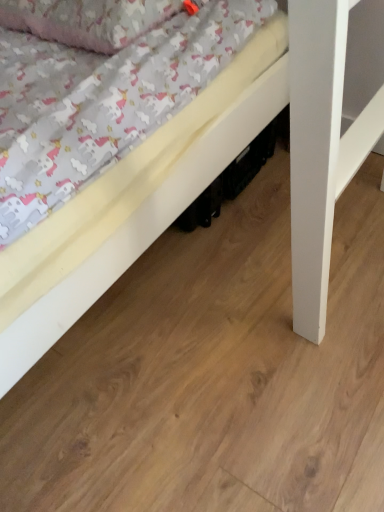
What do you see at coordinates (87, 20) in the screenshot? The width and height of the screenshot is (384, 512). I see `fluffy cotton pillow at upper left` at bounding box center [87, 20].

Identify the location of fluffy cotton pillow at upper left. (87, 20).

Where is `white matte bed at lower left`? This screenshot has width=384, height=512. white matte bed at lower left is located at coordinates (132, 204).

Image resolution: width=384 pixels, height=512 pixels. Describe the element at coordinates (132, 204) in the screenshot. I see `white matte bed at lower left` at that location.

I want to click on fluffy cotton pillow at upper left, so click(87, 20).

From the picture: Is white matte bed at lower left to the left of fluffy cotton pillow at upper left from the viewer's perspective?

Incorrect, white matte bed at lower left is not on the left side of fluffy cotton pillow at upper left.

Is white matte bed at lower left further to camera compared to fluffy cotton pillow at upper left?

No.

Considering the positions of point (223, 156) and point (49, 2), is point (223, 156) closer or farther from the camera than point (49, 2)?

Clearly, point (223, 156) is more distant from the camera than point (49, 2).

Based on the photo, from the image's perspective, is white matte bed at lower left located above fluffy cotton pillow at upper left?

Actually, white matte bed at lower left appears below fluffy cotton pillow at upper left in the image.

From a real-world perspective, between white matte bed at lower left and fluffy cotton pillow at upper left, who is vertically higher?

In real-world perspective, fluffy cotton pillow at upper left is above.

Considering the sizes of objects white matte bed at lower left and fluffy cotton pillow at upper left in the image provided, who is thinner, white matte bed at lower left or fluffy cotton pillow at upper left?

fluffy cotton pillow at upper left.

Which of these two, white matte bed at lower left or fluffy cotton pillow at upper left, stands shorter?

With less height is white matte bed at lower left.

Does white matte bed at lower left have a smaller size compared to fluffy cotton pillow at upper left?

Actually, white matte bed at lower left might be larger than fluffy cotton pillow at upper left.

Is white matte bed at lower left surrounding fluffy cotton pillow at upper left?

No, fluffy cotton pillow at upper left is located outside of white matte bed at lower left.

Are white matte bed at lower left and fluffy cotton pillow at upper left making contact?

No.

Is white matte bed at lower left positioned with its back to fluffy cotton pillow at upper left?

white matte bed at lower left does not have its back to fluffy cotton pillow at upper left.

Looking at this image, how different are the orientations of white matte bed at lower left and fluffy cotton pillow at upper left in degrees?

white matte bed at lower left and fluffy cotton pillow at upper left are facing 0.529 degrees away from each other.

Locate an element on the screen. bed located underneath the fluffy cotton pillow at upper left (from a real-world perspective) is located at coordinates (132, 204).

Between fluffy cotton pillow at upper left and white matte bed at lower left, which one appears on the left side from the viewer's perspective?

Positioned to the left is fluffy cotton pillow at upper left.

Which object is closer to the camera, fluffy cotton pillow at upper left or white matte bed at lower left?

Positioned in front is white matte bed at lower left.

Does point (161, 11) come behind point (15, 337)?

Yes, it is.

From the image's perspective, is fluffy cotton pillow at upper left below white matte bed at lower left?

Incorrect, from the image's perspective, fluffy cotton pillow at upper left is higher than white matte bed at lower left.

From a real-world perspective, who is located higher, fluffy cotton pillow at upper left or white matte bed at lower left?

fluffy cotton pillow at upper left, from a real-world perspective.

Considering the relative sizes of fluffy cotton pillow at upper left and white matte bed at lower left in the image provided, is fluffy cotton pillow at upper left thinner than white matte bed at lower left?

Correct, the width of fluffy cotton pillow at upper left is less than that of white matte bed at lower left.

Who is taller, fluffy cotton pillow at upper left or white matte bed at lower left?

Standing taller between the two is fluffy cotton pillow at upper left.

From the picture: Can you confirm if fluffy cotton pillow at upper left is bigger than white matte bed at lower left?

Incorrect, fluffy cotton pillow at upper left is not larger than white matte bed at lower left.

Based on the photo, choose the correct answer: Is fluffy cotton pillow at upper left inside white matte bed at lower left or outside it?

fluffy cotton pillow at upper left cannot be found inside white matte bed at lower left.

Is fluffy cotton pillow at upper left next to white matte bed at lower left and touching it?

No, fluffy cotton pillow at upper left is not in contact with white matte bed at lower left.

Is fluffy cotton pillow at upper left oriented away from white matte bed at lower left?

No, fluffy cotton pillow at upper left is not facing away from white matte bed at lower left.

Looking at this image, what's the angular difference between fluffy cotton pillow at upper left and white matte bed at lower left's facing directions?

The facing directions of fluffy cotton pillow at upper left and white matte bed at lower left are 0.529 degrees apart.

How far apart are fluffy cotton pillow at upper left and white matte bed at lower left?

fluffy cotton pillow at upper left and white matte bed at lower left are 12.39 inches apart from each other.

Find the location of a particular element. Image resolution: width=384 pixels, height=512 pixels. pillow on the left of white matte bed at lower left is located at coordinates (87, 20).

Locate an element on the screen. bed that appears below the fluffy cotton pillow at upper left (from a real-world perspective) is located at coordinates (132, 204).

Where is `pillow that appears on the left of white matte bed at lower left`? pillow that appears on the left of white matte bed at lower left is located at coordinates (87, 20).